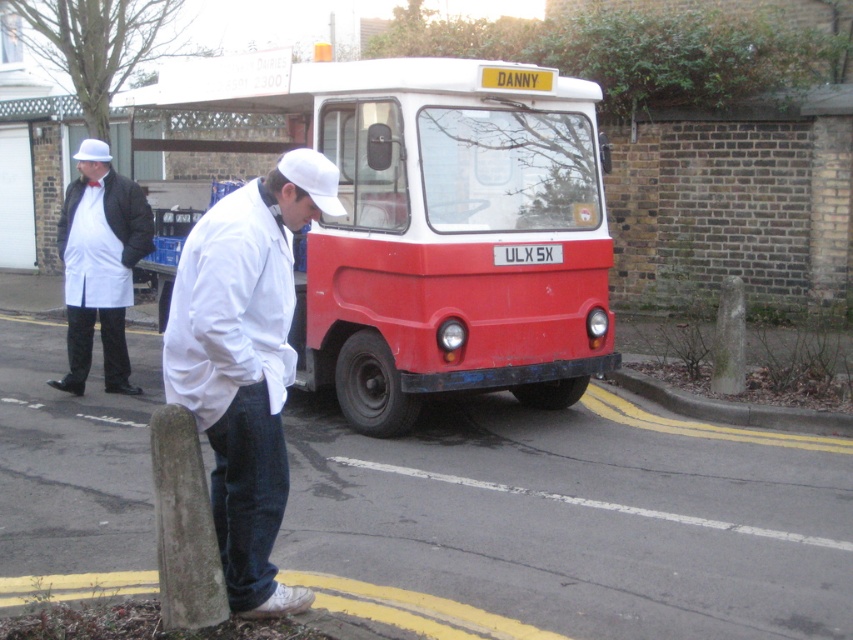
Is red matte food truck at center closer to camera compared to concrete at lower right?

Yes, red matte food truck at center is in front of concrete at lower right.

Describe the element at coordinates (434, 225) in the screenshot. I see `red matte food truck at center` at that location.

Is point (601, 298) less distant than point (627, 388)?

Yes, point (601, 298) is in front of point (627, 388).

The width and height of the screenshot is (853, 640). Find the location of `red matte food truck at center`. red matte food truck at center is located at coordinates (434, 225).

Can you confirm if white matte coat at left is wider than white plastic license plate at center?

Yes.

Does white matte coat at left have a larger size compared to white plastic license plate at center?

Correct, white matte coat at left is larger in size than white plastic license plate at center.

The height and width of the screenshot is (640, 853). Identify the location of white matte coat at left. [x=99, y=264].

Can you confirm if white matte coat at left is thinner than concrete at lower right?

Indeed, white matte coat at left has a lesser width compared to concrete at lower right.

This screenshot has height=640, width=853. I want to click on white matte coat at left, so click(99, 264).

Between point (73, 387) and point (663, 390), which one is positioned behind?

The point (73, 387) is behind.

At what (x,y) coordinates should I click in order to perform the action: click on white matte coat at left. Please return your answer as a coordinate pair (x, y). Image resolution: width=853 pixels, height=640 pixels. Looking at the image, I should click on (99, 264).